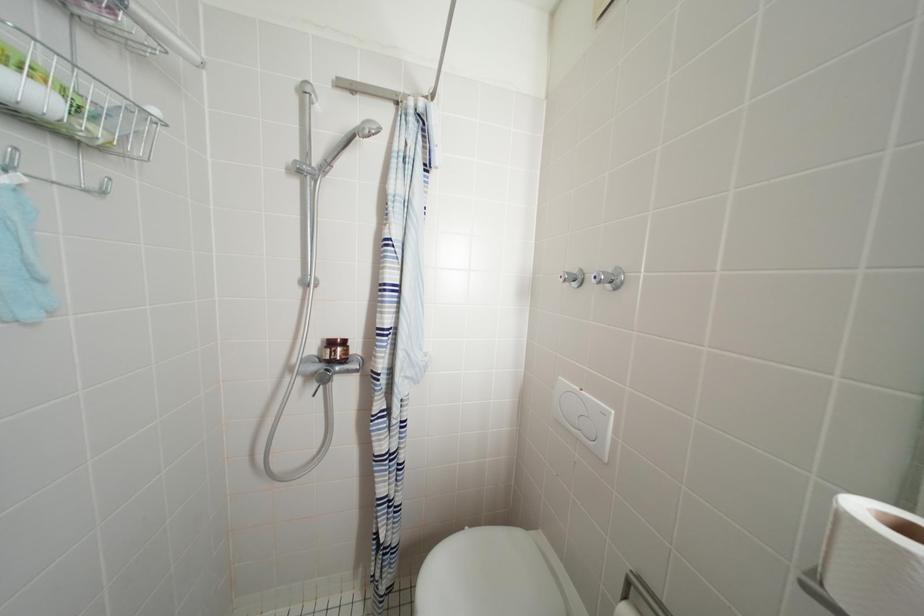
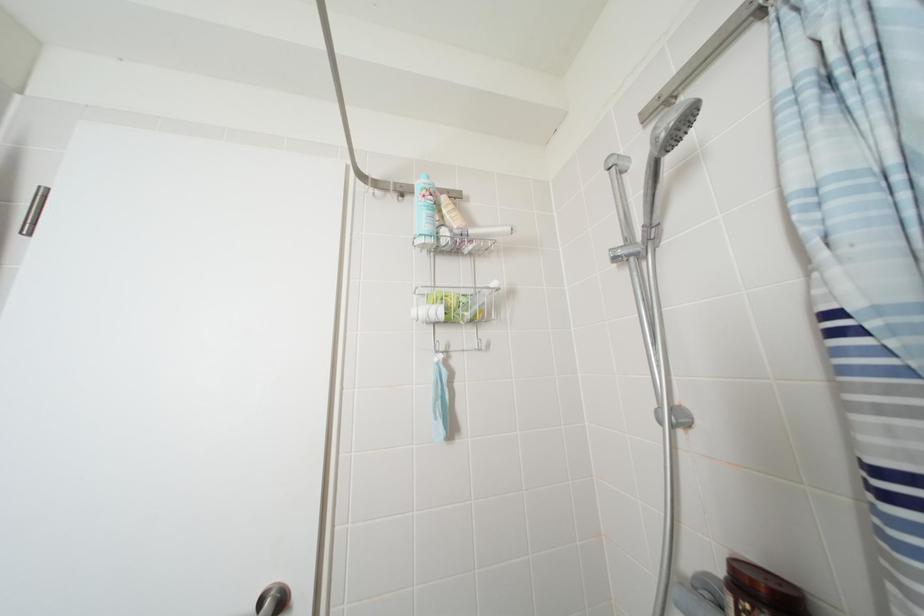
How did the camera likely rotate?

The camera rotated toward left-up.